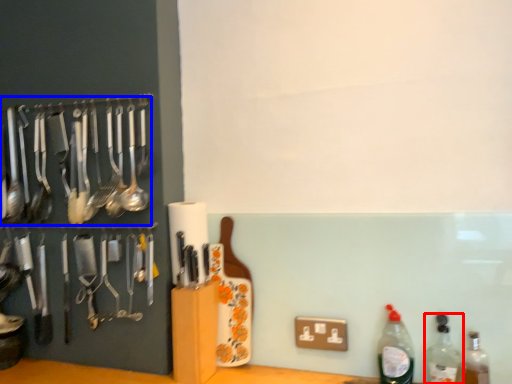
Question: Which of the following is the closest to the observer, bottle (highlighted by a red box) or spoon (highlighted by a blue box)?

Choices:
 (A) bottle
 (B) spoon

Answer: (A)